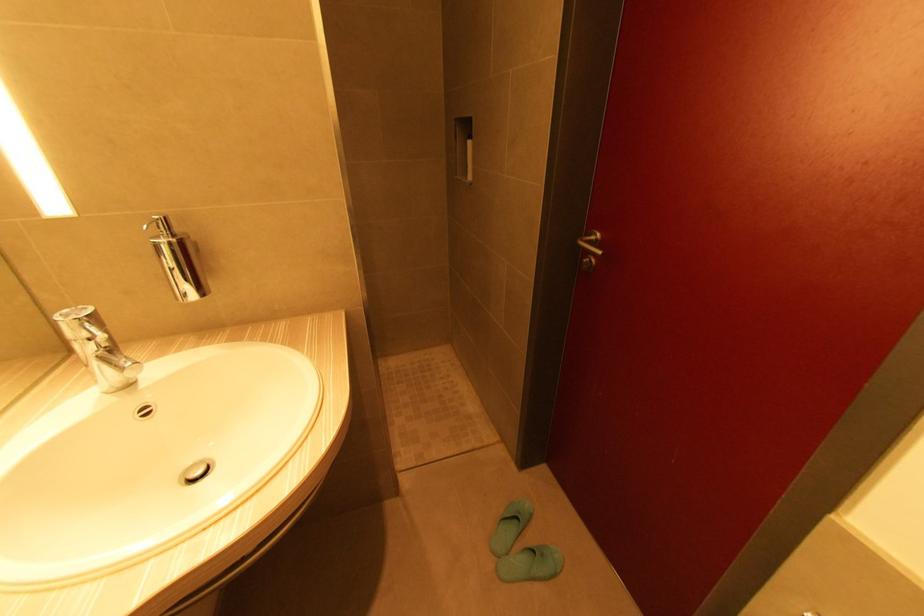
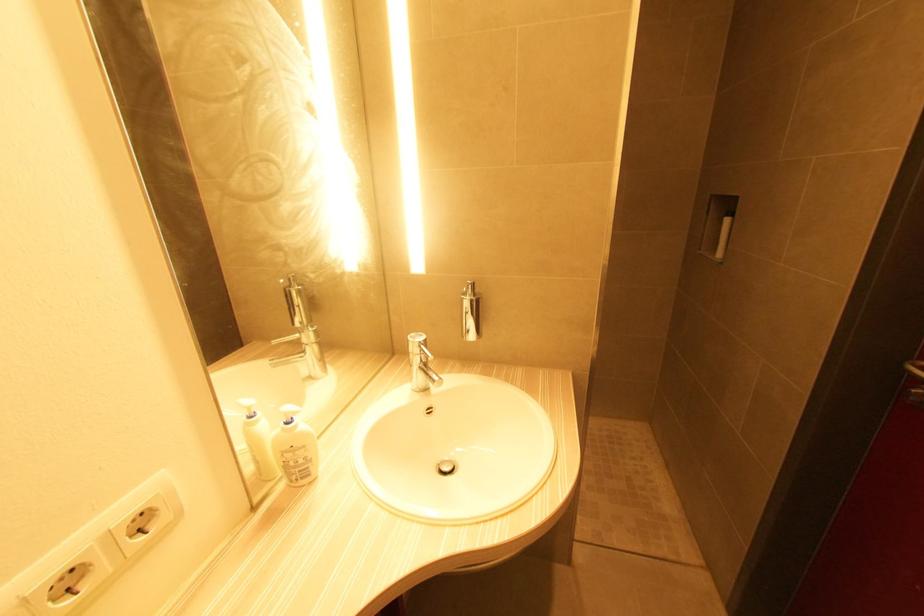
Question: The first image is from the beginning of the video and the second image is from the end. How did the camera likely rotate when shooting the video?

Choices:
 (A) Left
 (B) Right
 (C) Up
 (D) Down

Answer: (A)